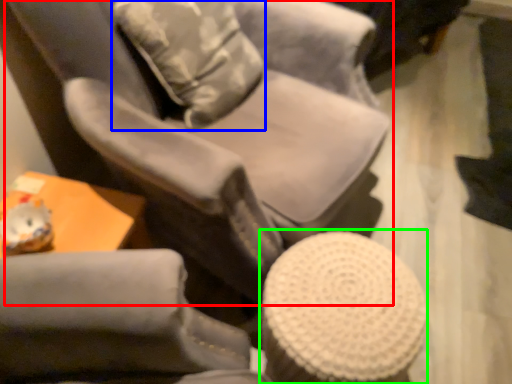
Question: Considering the real-world distances, which object is farthest from chair (highlighted by a red box)? throw pillow (highlighted by a blue box) or bar stool (highlighted by a green box)?

Choices:
 (A) throw pillow
 (B) bar stool

Answer: (B)